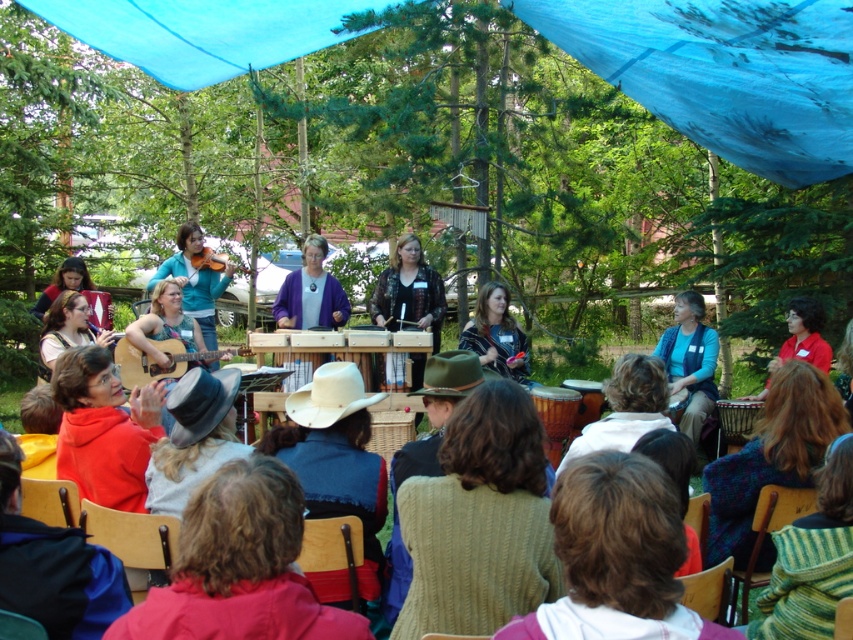
You are a photographer taking a picture of the audience members wearing the green knitted sweater at lower right and the blue felt cowboy hat at lower center. Which item will appear taller in the photo?

The green knitted sweater at lower right will appear taller in the photo because it has a greater height compared to the blue felt cowboy hat at lower center.

You are a photographer taking a picture of the knitted beige sweater at center and the matte brown guitar at lower left. Which object should you focus on first if you want to capture both in the frame without moving the camera?

The knitted beige sweater at center is much taller than the matte brown guitar at lower left, so you should focus on the knitted beige sweater at center first to ensure it fits properly in the frame.